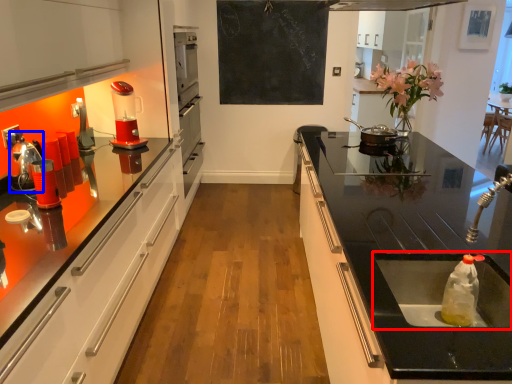
Question: Which object appears farthest to the camera in this image, sink (highlighted by a red box) or appliance (highlighted by a blue box)?

Choices:
 (A) sink
 (B) appliance

Answer: (B)